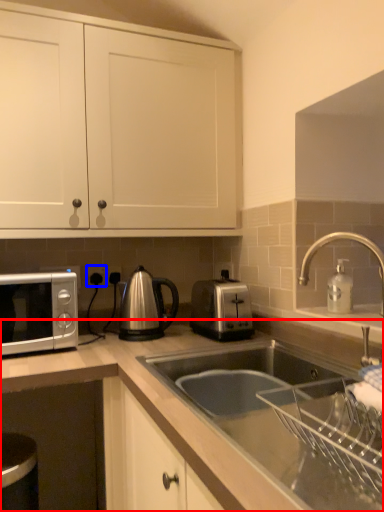
Question: Which object is closer to the camera taking this photo, countertop (highlighted by a red box) or electric outlet (highlighted by a blue box)?

Choices:
 (A) countertop
 (B) electric outlet

Answer: (A)